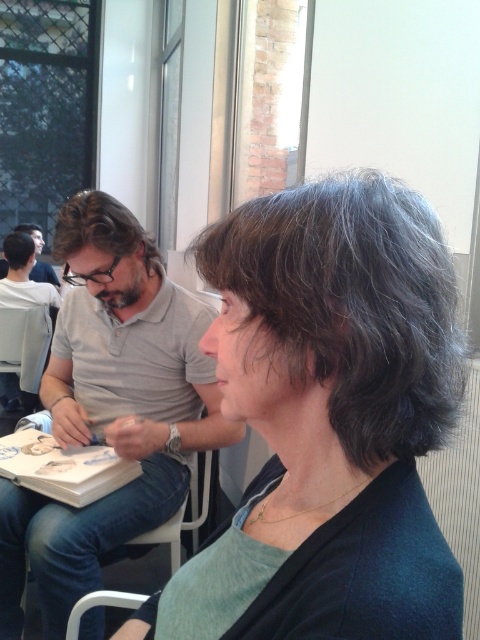
You are standing in front of the table where two people are discussing a book. There are two points marked on the table surface at coordinates point (316, 224) and point (1, 387). Which point is closer to you?

Point (316, 224) is closer to the camera than point (1, 387), so the point closer to you is point (316, 224).

You are standing in a room and see two items, the gray matte hair at center and the white shirt at left. Which one is closer to you?

The gray matte hair at center is closer to the viewer than the white shirt at left.